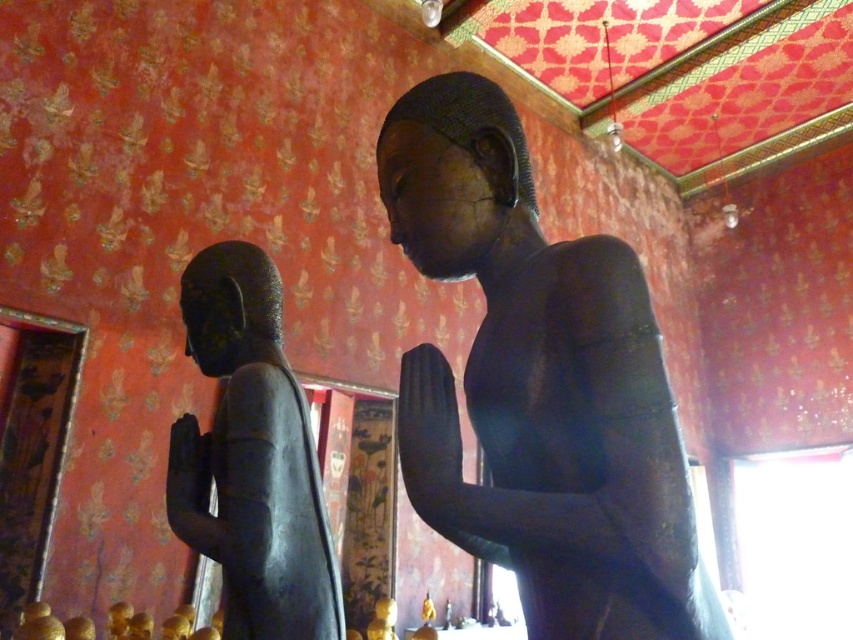
Question: Does matte black statue at center have a lesser width compared to matte black statue at left?

Choices:
 (A) no
 (B) yes

Answer: (A)

Question: Is matte black statue at center in front of matte black statue at left?

Choices:
 (A) no
 (B) yes

Answer: (B)

Question: Can you confirm if matte black statue at center is positioned to the right of matte black statue at left?

Choices:
 (A) yes
 (B) no

Answer: (A)

Question: Which point is closer to the camera taking this photo?

Choices:
 (A) (672, 577)
 (B) (267, 429)

Answer: (A)

Question: Which of the following is the closest to the observer?

Choices:
 (A) (488, 305)
 (B) (318, 504)

Answer: (A)

Question: Which point appears closest to the camera in this image?

Choices:
 (A) (392, 154)
 (B) (276, 534)

Answer: (A)